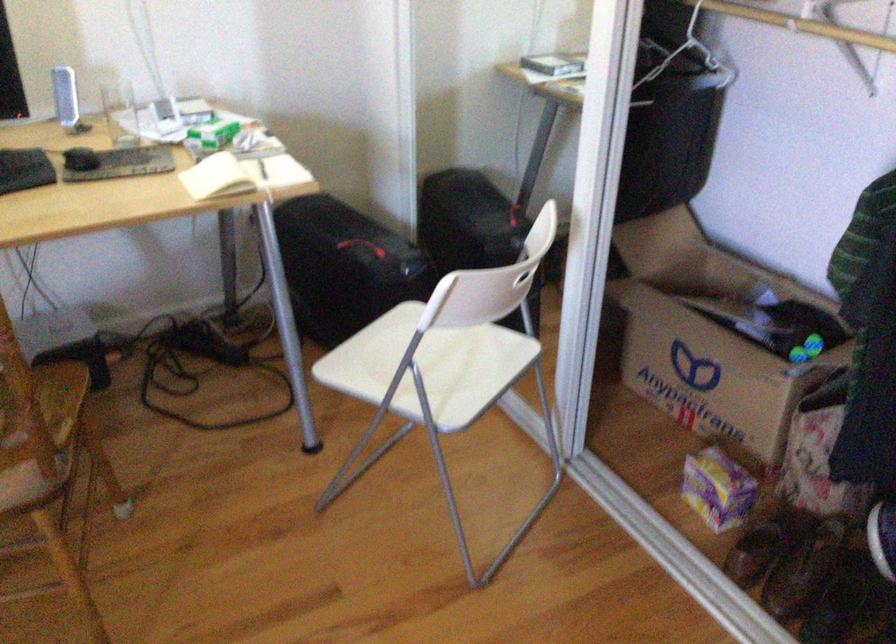
The image size is (896, 644). I want to click on open white notebook, so click(x=242, y=175).